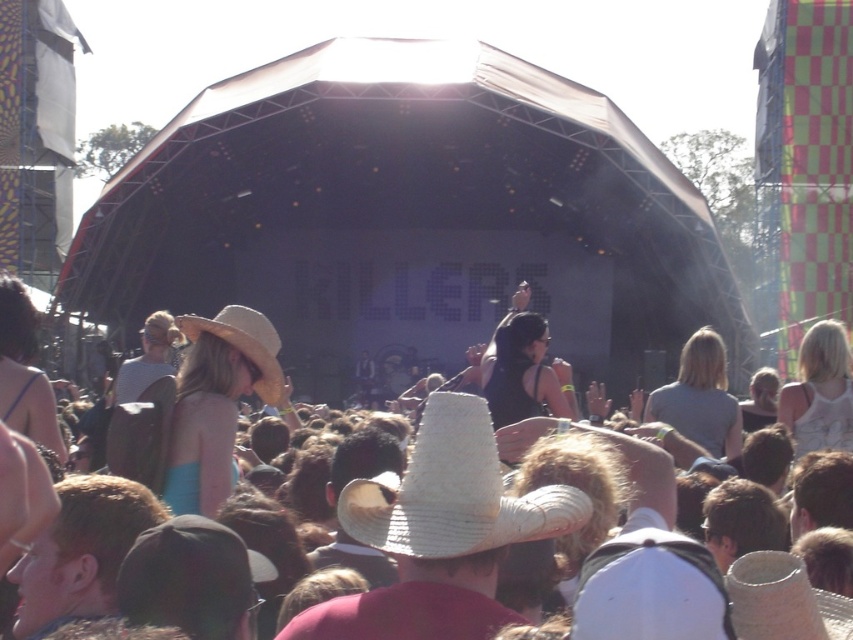
Question: Observing the image, what is the correct spatial positioning of strawhat at left in reference to strawmaterial/texturehat at upper center?

Choices:
 (A) right
 (B) left

Answer: (A)

Question: Considering the relative positions of straw hat at center and strawmaterial/texturehat at upper center in the image provided, where is straw hat at center located with respect to strawmaterial/texturehat at upper center?

Choices:
 (A) below
 (B) above

Answer: (A)

Question: Which point is closer to the camera?

Choices:
 (A) strawhat at left
 (B) white straw cowboy hat at center
 (C) strawmaterial/texturehat at upper center
 (D) straw hat at center

Answer: (B)

Question: Does white straw cowboy hat at center lie in front of straw hat at center?

Choices:
 (A) yes
 (B) no

Answer: (A)

Question: Which of the following is the closest to the observer?

Choices:
 (A) strawhat at left
 (B) strawmaterial/texturehat at upper center
 (C) straw hat at center

Answer: (C)

Question: Which of the following is the farthest from the observer?

Choices:
 (A) white straw cowboy hat at center
 (B) strawhat at left
 (C) strawmaterial/texturehat at upper center

Answer: (C)